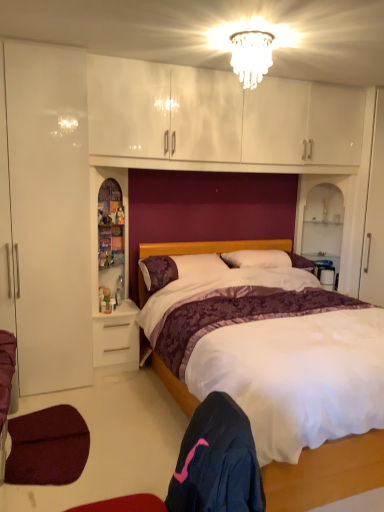
Image resolution: width=384 pixels, height=512 pixels. Identify the location of vacant space situated above clear glass chandelier at upper center (from a real-world perspective). (253, 38).